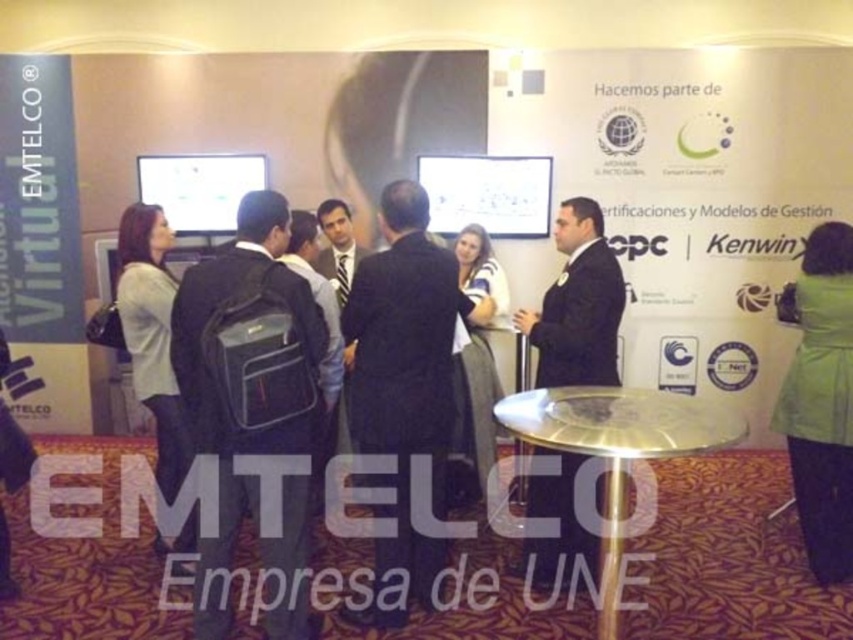
You are a photographer at the event and need to arrange the two individuals wearing the dark suit at center and the matte gray blazer at left for a group photo. Based on their current positions, which one is positioned more to the left side of the scene?

The matte gray blazer at left is positioned more to the left side of the scene since the dark suit at center is to the right of it.

Based on the photo, you are standing at the conference booth and need to determine which of the two points, point (546, 305) or point (474, 227), is closer to you. Based on the scene, which point is nearer?

Point (546, 305) is closer to the camera than point (474, 227), so it is the nearer point.